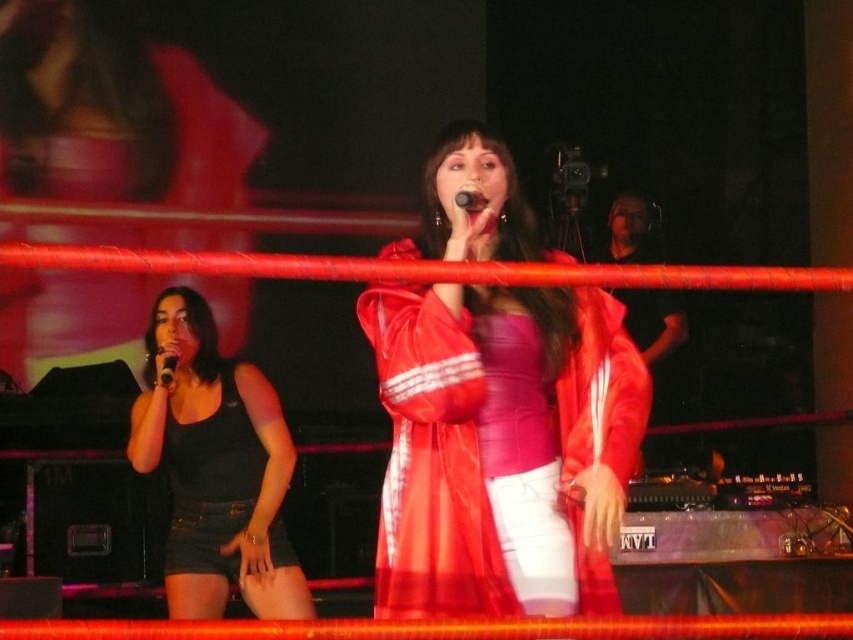
Does black fabric tank top at left have a larger size compared to black plastic microphone at center?

Yes.

Does black fabric tank top at left appear on the right side of black plastic microphone at center?

Incorrect, black fabric tank top at left is not on the right side of black plastic microphone at center.

I want to click on black fabric tank top at left, so click(x=216, y=468).

Identify the location of black fabric tank top at left. This screenshot has height=640, width=853. (216, 468).

Is black fabric tank top at left shorter than black matte tank top at left?

No.

Which is below, black fabric tank top at left or black matte tank top at left?

black matte tank top at left is below.

Is point (196, 486) less distant than point (173, 486)?

Yes, it is in front of point (173, 486).

The image size is (853, 640). Identify the location of black fabric tank top at left. (x=216, y=468).

Which is more to the right, black matte tank top at left or black plastic microphone at center?

Positioned to the right is black plastic microphone at center.

Who is more distant from viewer, [218,540] or [477,198]?

Point [218,540]

Locate an element on the screen. The image size is (853, 640). black matte tank top at left is located at coordinates (212, 483).